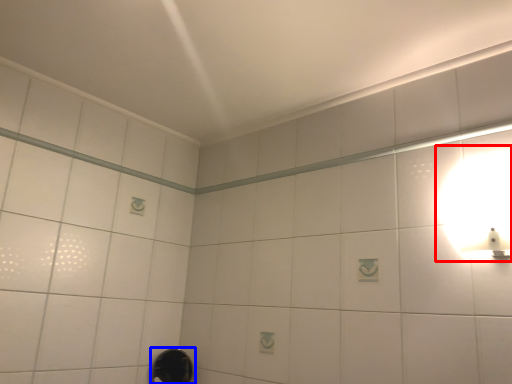
Question: Among these objects, which one is farthest to the camera, light fixture (highlighted by a red box) or shower (highlighted by a blue box)?

Choices:
 (A) light fixture
 (B) shower

Answer: (B)